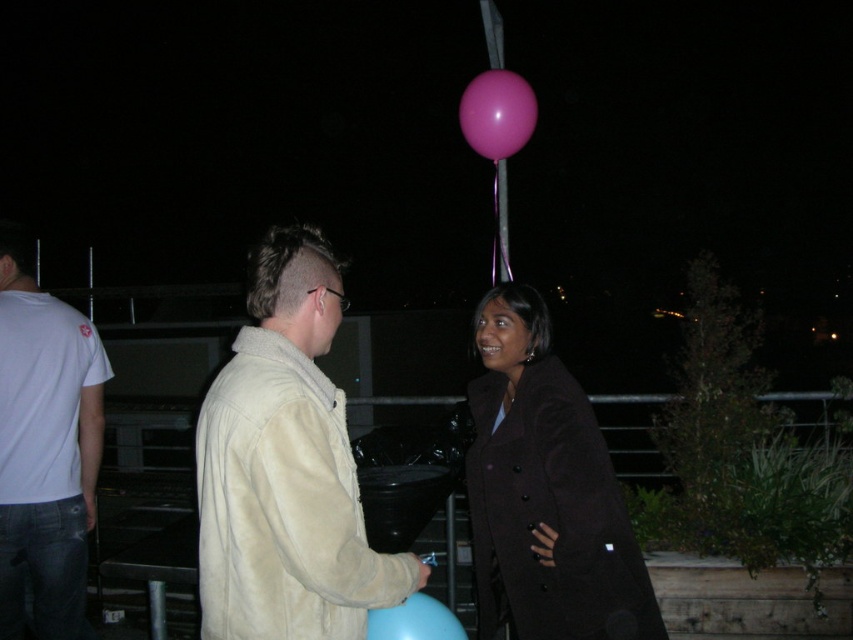
Question: Is the position of pink rubber balloon at upper center more distant than that of blue rubber balloon at lower center?

Choices:
 (A) no
 (B) yes

Answer: (B)

Question: Which object appears closest to the camera in this image?

Choices:
 (A) suede jacket at center
 (B) blue rubber balloon at lower center
 (C) dark brown wool coat at center

Answer: (A)

Question: Can you confirm if dark brown wool coat at center is smaller than white cotton t-shirt at left?

Choices:
 (A) no
 (B) yes

Answer: (A)

Question: Which point appears closest to the camera in this image?

Choices:
 (A) (468, 113)
 (B) (16, 330)

Answer: (B)

Question: Which object is the closest to the blue rubber balloon at lower center?

Choices:
 (A) white cotton t-shirt at left
 (B) dark brown wool coat at center
 (C) suede jacket at center
 (D) pink rubber balloon at upper center

Answer: (C)

Question: Does white cotton t-shirt at left have a larger size compared to pink rubber balloon at upper center?

Choices:
 (A) no
 (B) yes

Answer: (B)